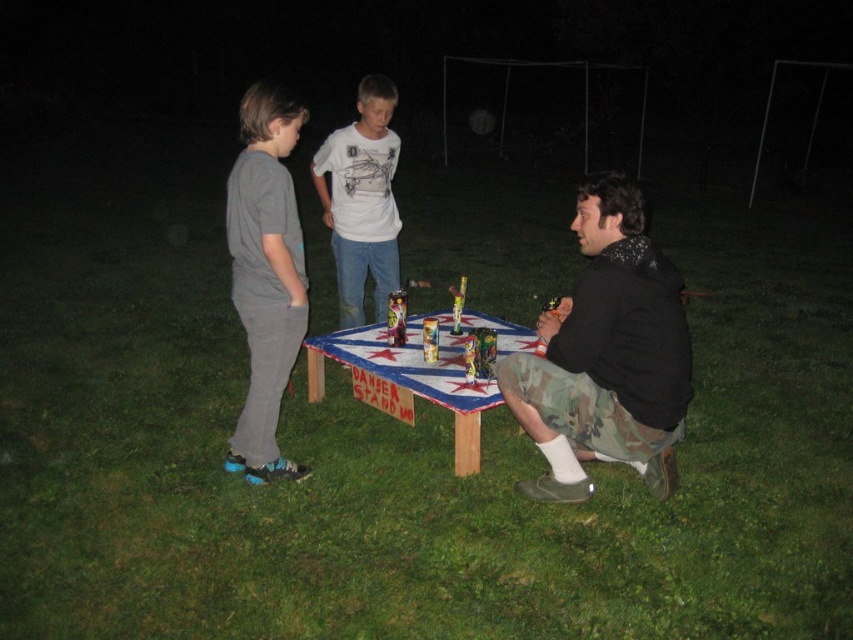
You are planning to place a large pizza box on the wooden painted table at center. Considering the size of the white cotton shirt at center, will the pizza box fit on the table without overlapping the shirt?

The wooden painted table at center has a larger size compared to the white cotton shirt at center, so the pizza box should fit on the table without overlapping the shirt.

You are trying to place a new item on the table in the scene. The table is located at point 0.5, 0.5. Where should you place the new item so that it is closer to the camo shorts at lower right than to the edge of the table?

The camo shorts at lower right is located at point (605, 355). To place the new item closer to the camo shorts than to the edge of the table, position it near the coordinates (605, 355) but within the table boundaries.

You are trying to find the camo shorts at lower right in the nighttime scene. According to the coordinates provided, where exactly would you look on the image?

The camo shorts at lower right is located at point 0.555 on the x axis and 0.710 on the y axis.